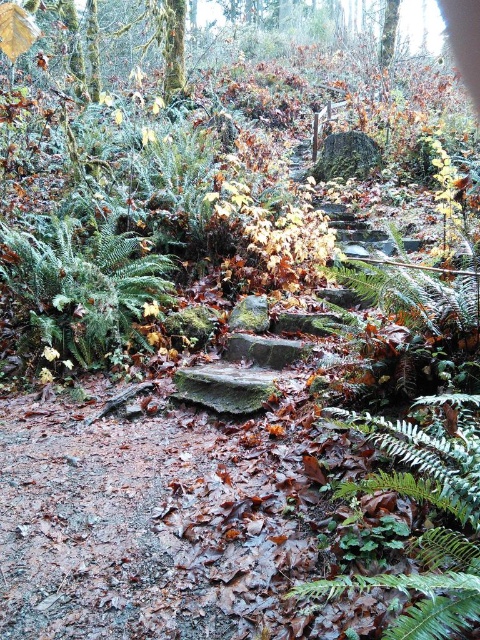
You are a hiker carrying a backpack and need to step between the green matte fern at center and the green matte fern at left. Can you safely walk through the space between them?

The green matte fern at center and the green matte fern at left are 8.32 feet apart, so yes, you can safely walk through the space between them as the distance is sufficient for a hiker to pass comfortably.

You are a hiker navigating the forest and want to reach the bottom of the stone staircase. You see two points marked in the image. Which point, point (x=423, y=621) or point (x=134, y=260), is closer to you as you stand at the top of the staircase?

Point (x=423, y=621) is closer to the viewer than point (x=134, y=260), so the closer point is point (x=423, y=621).